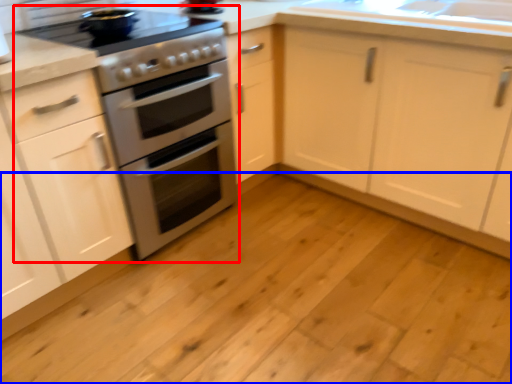
Question: Which object appears farthest to the camera in this image, appliance (highlighted by a red box) or plain (highlighted by a blue box)?

Choices:
 (A) appliance
 (B) plain

Answer: (A)